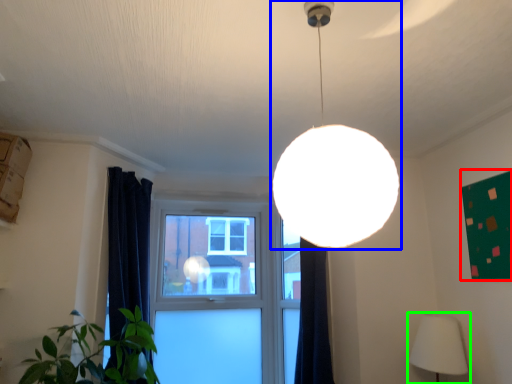
Question: Which object is positioned farthest from bulletin board (highlighted by a red box)? Select from lamp (highlighted by a blue box) and lamp (highlighted by a green box).

Choices:
 (A) lamp
 (B) lamp

Answer: (A)